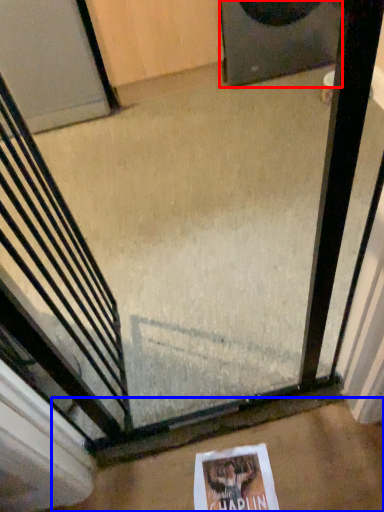
Question: Which object is further to the camera taking this photo, speaker (highlighted by a red box) or concrete (highlighted by a blue box)?

Choices:
 (A) speaker
 (B) concrete

Answer: (A)